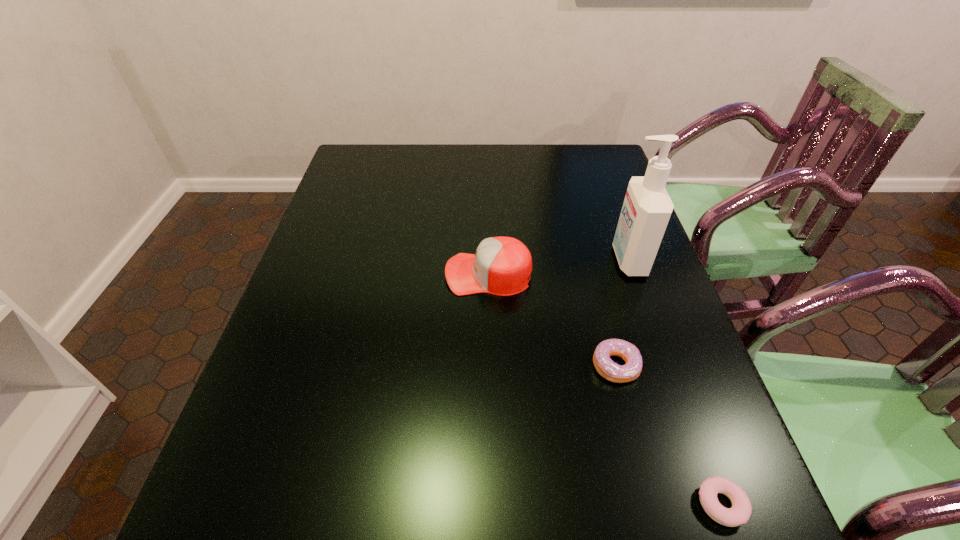
In order to click on vacant area situated on the front-facing side of the leftmost object in this screenshot , I will do click(x=304, y=274).

Locate an element on the screen. Image resolution: width=960 pixels, height=540 pixels. vacant region located 0.140m on the front-facing side of the leftmost object is located at coordinates (391, 274).

Identify the location of vacant space situated 0.150m on the front-facing side of the leftmost object. (387, 274).

Find the location of a particular element. The height and width of the screenshot is (540, 960). vacant space located 0.380m on the back of the second shortest object is located at coordinates (583, 236).

Image resolution: width=960 pixels, height=540 pixels. I want to click on vacant space situated on the back of the nearest object, so click(666, 352).

The height and width of the screenshot is (540, 960). Find the location of `object that is positioned at the near edge`. object that is positioned at the near edge is located at coordinates (739, 513).

Where is `cleansing agent that is at the right edge`? Image resolution: width=960 pixels, height=540 pixels. cleansing agent that is at the right edge is located at coordinates (647, 207).

Image resolution: width=960 pixels, height=540 pixels. I want to click on object that is at the near right corner, so click(x=739, y=513).

Where is `free space at the far edge of the desktop`? free space at the far edge of the desktop is located at coordinates (443, 180).

At what (x,y) coordinates should I click in order to perform the action: click on vacant space at the near edge of the desktop. Please return your answer as a coordinate pair (x, y). Looking at the image, I should click on (453, 525).